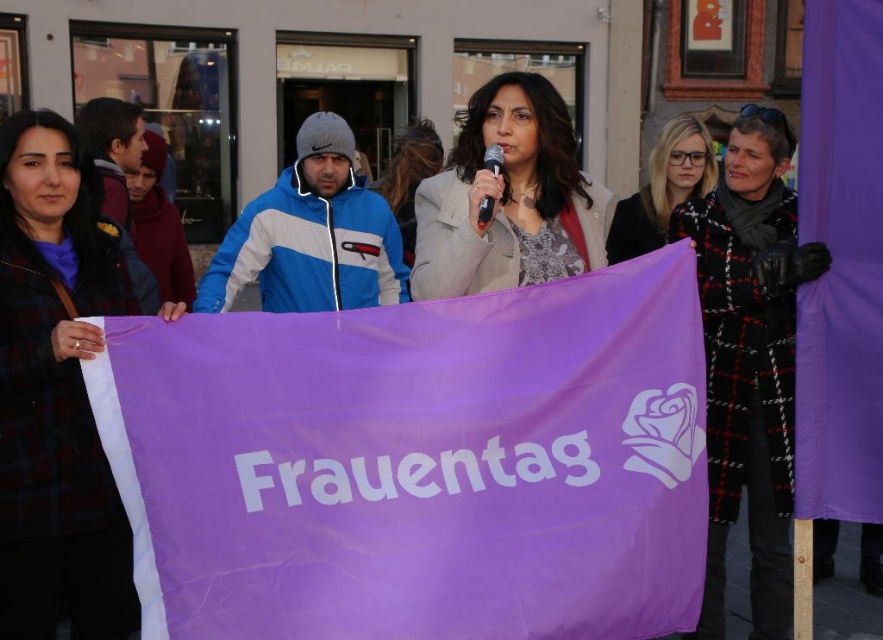
You are a photographer trying to capture a photo of the event. You notice two points in the image at coordinates point (715, 307) and point (674, 173). Which point should you focus on to ensure it appears sharper in the photo?

Point (715, 307) is closer to the camera than point (674, 173), so focusing on point (715, 307) will ensure it appears sharper in the photo.

You are a photographer trying to capture the purple fabric banner at center for a news article. The banner is positioned at coordinates 0.725 on the x and 0.473 on the y. If your camera frame is set to focus on the center point of the image, which is at coordinates 0.5 on both axes, will the banner be centered in your photo?

The purple fabric banner at center is located at point (417, 464), which is to the right and slightly below the center point of the image at 0.5, so the banner will not be perfectly centered in the photo.

You are a photographer standing at the edge of the crowd. You want to capture a photo that includes both the black checkered coat at center and the blonde hair at center. What is the minimum distance you need to step back to ensure both are in frame?

The minimum distance you need to step back is 2.80 meters to ensure both the black checkered coat at center and the blonde hair at center are in frame.